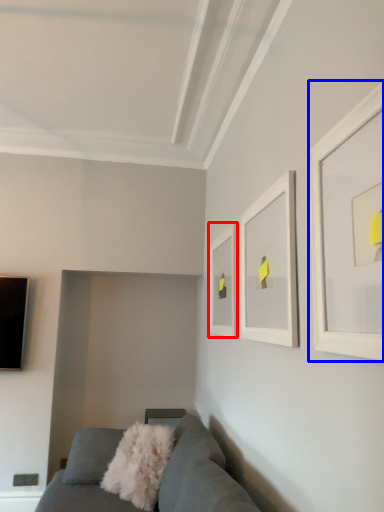
Question: Which point is closer to the camera, picture frame (highlighted by a red box) or picture frame (highlighted by a blue box)?

Choices:
 (A) picture frame
 (B) picture frame

Answer: (B)